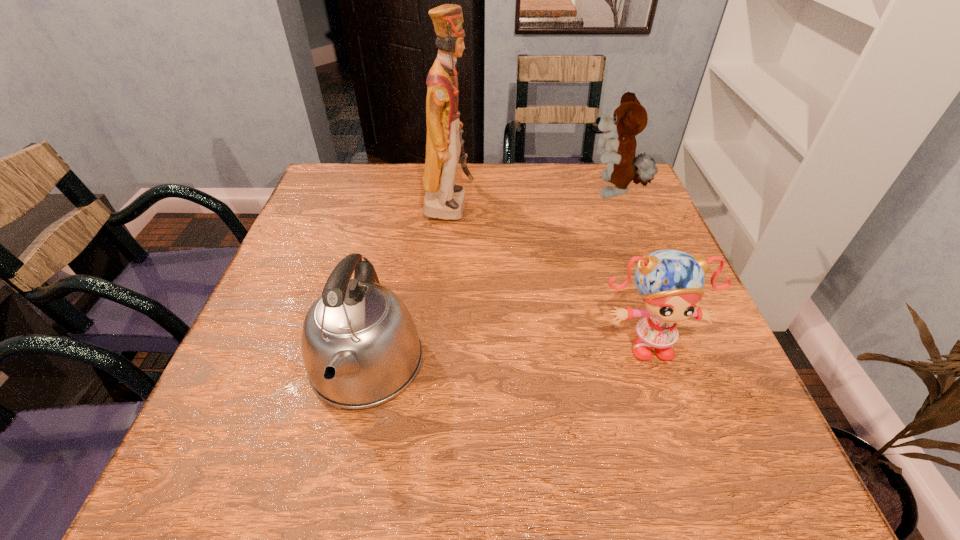
Image resolution: width=960 pixels, height=540 pixels. In the image, there is a desktop. Identify the location of vacant space at the far left corner. click(373, 190).

Where is `vacant space at the near right corner of the desktop`? This screenshot has height=540, width=960. vacant space at the near right corner of the desktop is located at coordinates (717, 478).

Identify the location of free space between the puppy and the tallest object. The width and height of the screenshot is (960, 540). [x=532, y=198].

Identify the location of free spot between the nutcracker and the doll. The height and width of the screenshot is (540, 960). click(x=548, y=272).

The height and width of the screenshot is (540, 960). I want to click on free space between the kettle and the puppy, so click(x=491, y=278).

Identify the location of free space between the doll and the kettle. Image resolution: width=960 pixels, height=540 pixels. (506, 352).

Locate an element on the screen. The height and width of the screenshot is (540, 960). vacant area that lies between the nutcracker and the doll is located at coordinates (548, 272).

Find the location of a particular element. This screenshot has width=960, height=540. free space between the nutcracker and the puppy is located at coordinates (532, 198).

In order to click on vacant area that lies between the puppy and the tallest object in this screenshot , I will do `click(532, 198)`.

This screenshot has width=960, height=540. Identify the location of free area in between the kettle and the puppy. (491, 278).